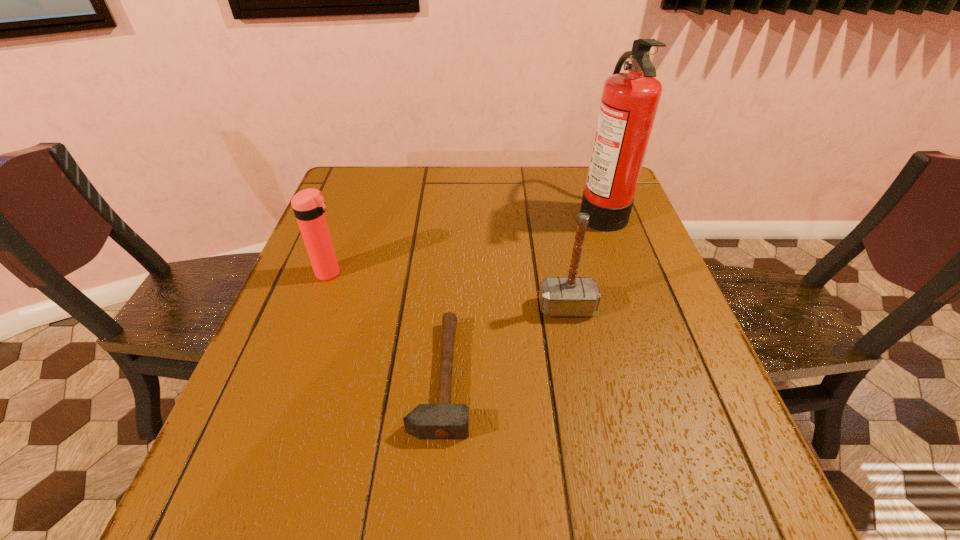
The width and height of the screenshot is (960, 540). I want to click on vacant position at the left edge of the desktop, so click(313, 446).

In the image, there is a desktop. At what (x,y) coordinates should I click in order to perform the action: click on vacant space at the right edge. Please return your answer as a coordinate pair (x, y). The image size is (960, 540). Looking at the image, I should click on (656, 461).

Where is `vacant area at the far left corner of the desktop`? vacant area at the far left corner of the desktop is located at coordinates (386, 193).

Find the location of a particular element. The image size is (960, 540). empty space between the leftmost object and the fire extinguisher is located at coordinates (466, 242).

Identify the location of free space between the left hammer and the farthest object. This screenshot has width=960, height=540. (521, 293).

Where is `free space that is in between the thermos bottle and the second object from left to right`? free space that is in between the thermos bottle and the second object from left to right is located at coordinates (386, 325).

You are a GUI agent. You are given a task and a screenshot of the screen. Output one action in this format:
    pyautogui.click(x=<x>, y=<y>)
    Task: Click on the vacant area between the rightmost object and the second farthest object
    
    Given the screenshot: What is the action you would take?
    pyautogui.click(x=466, y=242)

Identify the location of free space between the leftmost object and the third object from right to left. This screenshot has height=540, width=960. (386, 325).

The image size is (960, 540). Find the location of `vacant space in between the nearest object and the thermos bottle`. vacant space in between the nearest object and the thermos bottle is located at coordinates (386, 325).

Where is `free space between the leftmost object and the farther hammer`? This screenshot has width=960, height=540. free space between the leftmost object and the farther hammer is located at coordinates (448, 291).